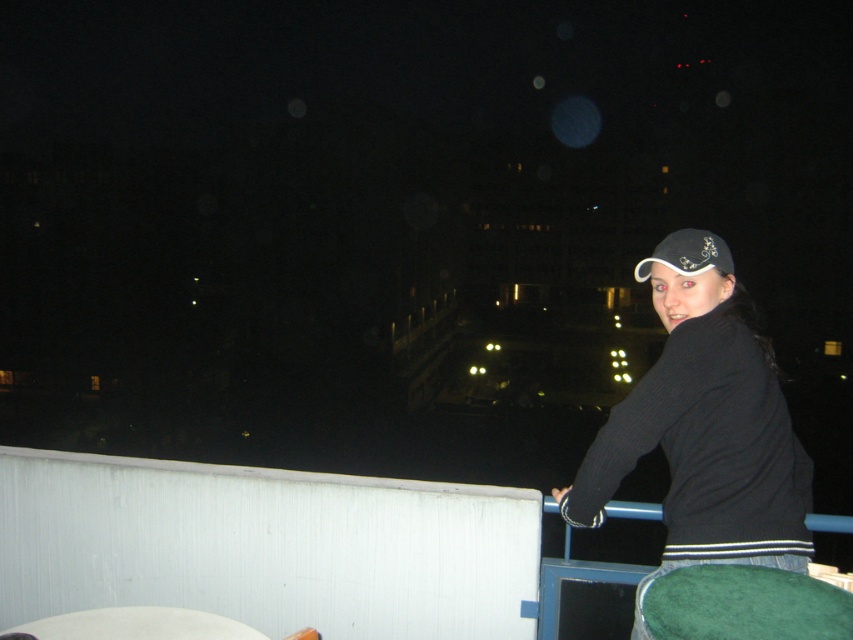
Question: In this image, where is black ribbed sweater at upper right located relative to black fabric cap at upper right?

Choices:
 (A) left
 (B) right

Answer: (A)

Question: Which point appears closest to the camera in this image?

Choices:
 (A) (723, 246)
 (B) (788, 515)

Answer: (B)

Question: Can you confirm if black ribbed sweater at upper right is positioned to the right of black fabric cap at upper right?

Choices:
 (A) no
 (B) yes

Answer: (A)

Question: Is black ribbed sweater at upper right further to camera compared to black fabric cap at upper right?

Choices:
 (A) no
 (B) yes

Answer: (A)

Question: Among these objects, which one is farthest from the camera?

Choices:
 (A) black fabric cap at upper right
 (B) black ribbed sweater at upper right

Answer: (A)

Question: Which point is farther from the camera taking this photo?

Choices:
 (A) (660, 372)
 (B) (686, 250)

Answer: (B)